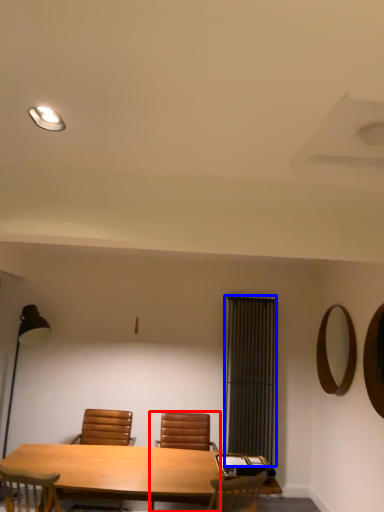
Question: Which point is further to the camera, chair (highlighted by a red box) or curtain (highlighted by a blue box)?

Choices:
 (A) chair
 (B) curtain

Answer: (B)